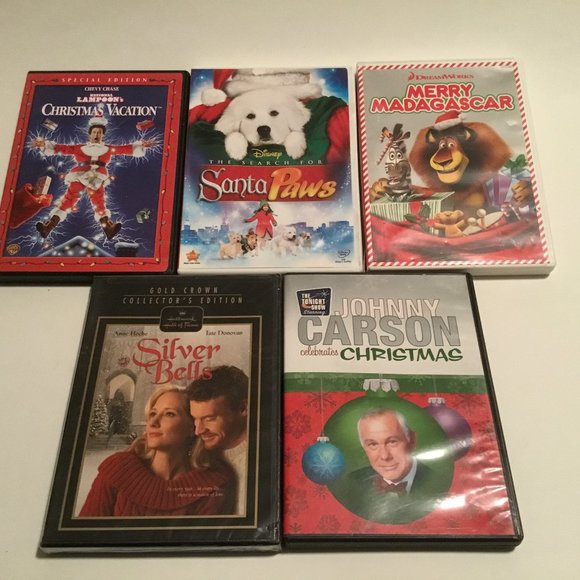
Image resolution: width=580 pixels, height=580 pixels. I want to click on dvd's, so click(97, 202), click(132, 333), click(418, 364), click(440, 126), click(300, 146).